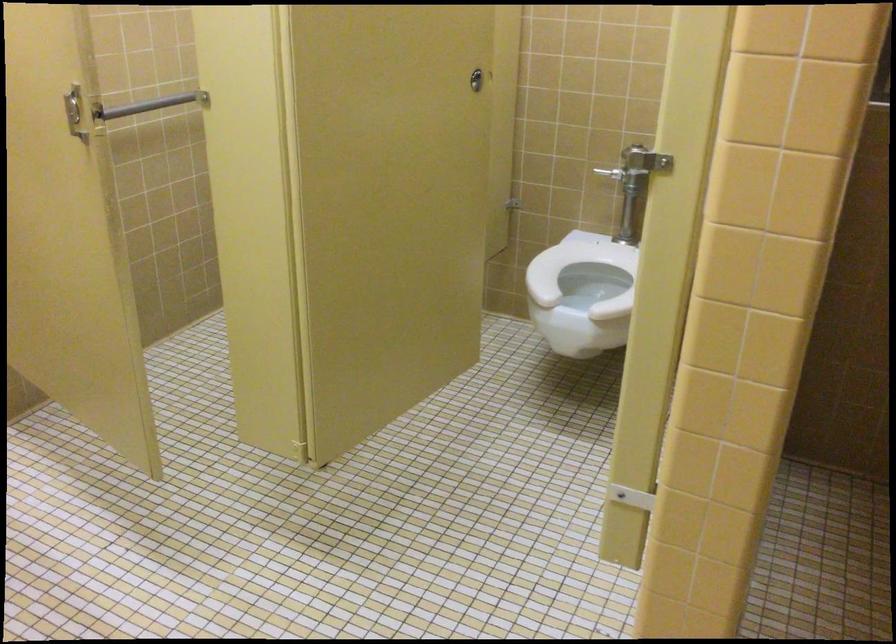
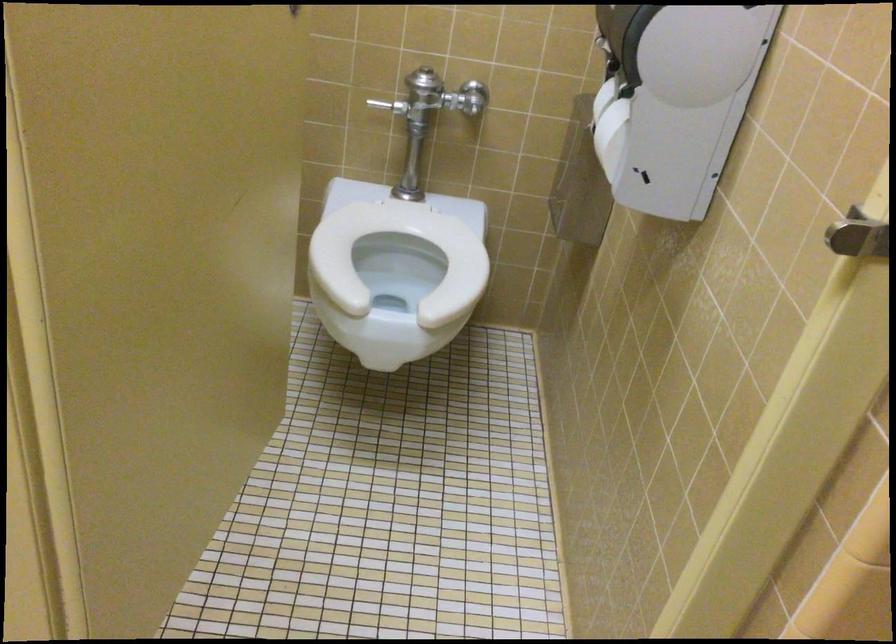
Question: The images are taken continuously from a first-person perspective. In which direction is your viewpoint rotating?

Choices:
 (A) Left
 (B) Right
 (C) Up
 (D) Down

Answer: (B)